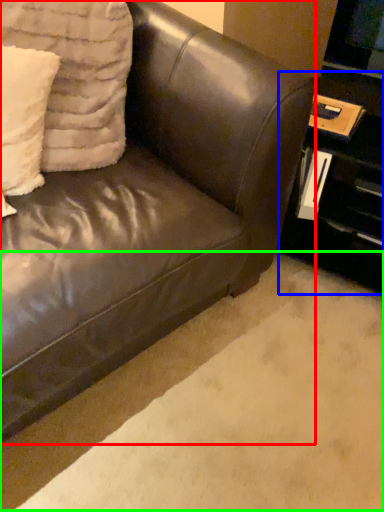
Question: Which is farther away from studio couch (highlighted by a red box)? table (highlighted by a blue box) or plain (highlighted by a green box)?

Choices:
 (A) table
 (B) plain

Answer: (A)